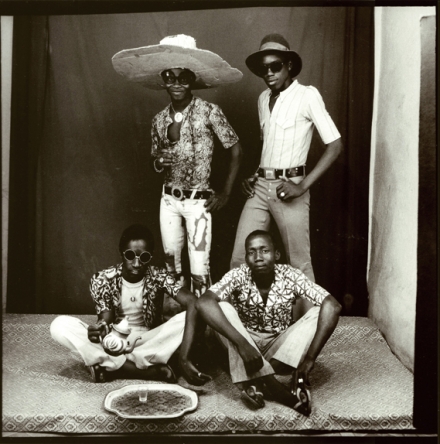
Find the location of a particular element. The image size is (440, 444). light gray wall is located at coordinates (399, 96).